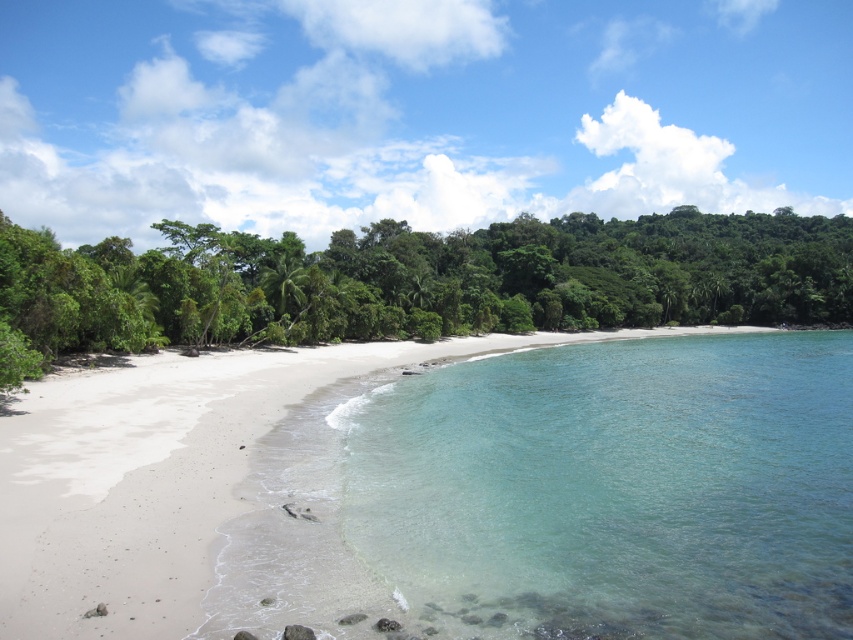
Who is more distant from viewer, [602,416] or [479,296]?

The point [479,296] is behind.

Does clear glassy water at center appear on the left side of green leafy trees at center?

Indeed, clear glassy water at center is positioned on the left side of green leafy trees at center.

Identify the location of clear glassy water at center. (614, 488).